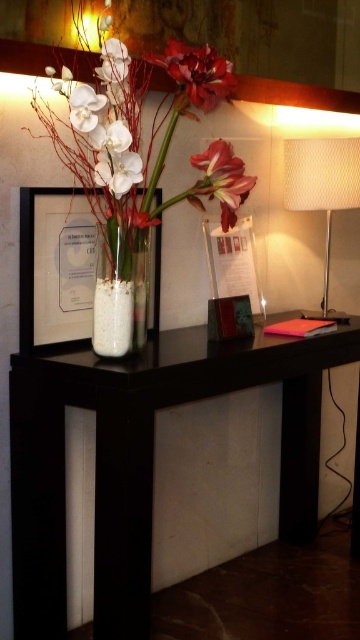
Does white matte vase at center appear under clear glass vase at center?

Incorrect, white matte vase at center is not positioned below clear glass vase at center.

Is white matte vase at center wider than clear glass vase at center?

Indeed, white matte vase at center has a greater width compared to clear glass vase at center.

Which is behind, point (117, 269) or point (106, 230)?

Positioned behind is point (106, 230).

Find the location of a particular element. The image size is (360, 640). white matte vase at center is located at coordinates (142, 164).

Can you confirm if black matte table at center is shorter than matte white vase at center?

No.

What do you see at coordinates (142, 458) in the screenshot? I see `black matte table at center` at bounding box center [142, 458].

The width and height of the screenshot is (360, 640). Identify the location of black matte table at center. (142, 458).

Who is positioned more to the right, matte black frame at left or matte white flower at center?

Positioned to the right is matte white flower at center.

Which is more to the left, matte black frame at left or matte white flower at center?

From the viewer's perspective, matte black frame at left appears more on the left side.

Is point (43, 308) closer to camera compared to point (221, 184)?

That is False.

At what (x,y) coordinates should I click in order to perform the action: click on matte black frame at left. Please return your answer as a coordinate pair (x, y). The height and width of the screenshot is (640, 360). Looking at the image, I should click on (56, 268).